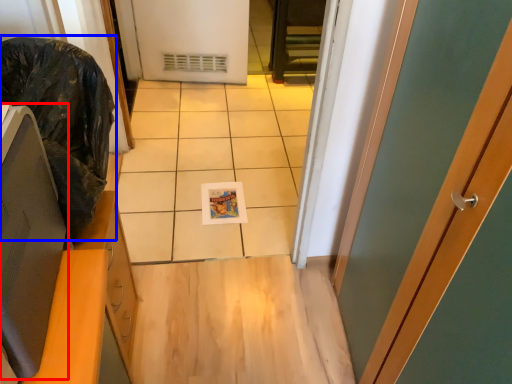
Question: Which object is closer to the camera taking this photo, computer monitor (highlighted by a red box) or garbage (highlighted by a blue box)?

Choices:
 (A) computer monitor
 (B) garbage

Answer: (A)